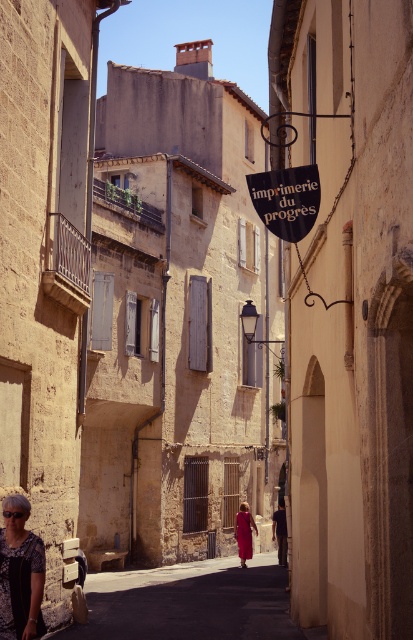
Can you confirm if matte black shirt at lower left is taller than matte red dress at center?

No, matte black shirt at lower left is not taller than matte red dress at center.

Is point (12, 602) farther from camera compared to point (247, 504)?

That is False.

The image size is (413, 640). In order to click on matte black shirt at lower left in this screenshot , I will do `click(18, 570)`.

Who is taller, matte black shirt at lower left or black plastic sign at center?

Standing taller between the two is matte black shirt at lower left.

Between matte black shirt at lower left and black plastic sign at center, which one is positioned higher?

black plastic sign at center is above.

This screenshot has width=413, height=640. What are the coordinates of `matte black shirt at lower left` in the screenshot? It's located at (18, 570).

Who is more forward, (101, 588) or (26, 540)?

Positioned in front is point (26, 540).

Locate an element on the screen. smooth concrete alley at center is located at coordinates click(x=189, y=602).